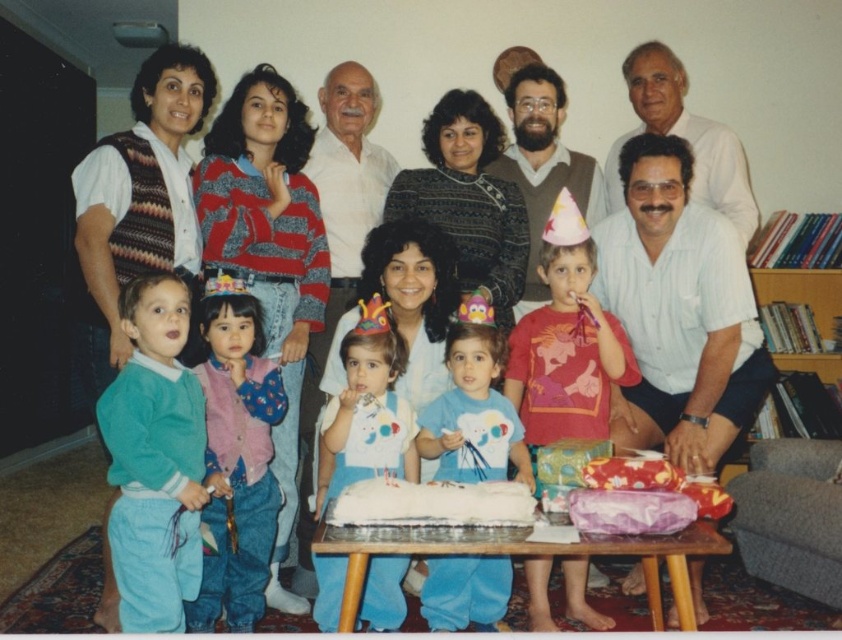
You are taking a photo of the birthday celebration and want to focus on both the point at coordinates point (x=315, y=604) and the point at coordinates point (x=388, y=524). Which point should you focus on first to ensure both are in focus?

You should focus on point (x=315, y=604) first because it is closer to the camera than point (x=388, y=524). This way, adjusting the focus from the closer point to the farther one will help ensure both are in focus.

You are a photographer standing at the camera position. You want to take a closeup photo of the fluffy pink vest at center. The camera has a minimum focusing distance of 5 feet. Can you take the photo?

The fluffy pink vest at center is 7.75 feet from camera. Since the minimum focusing distance is 5 feet, the camera can focus on the fluffy pink vest at center because it is beyond the minimum distance required.

You are a photographer at the birthday celebration and want to capture a photo of the white frosted cake at center without the white matte bib at center appearing in the shot. Based on their positions, which direction should you move the cake or the bib to achieve this?

Since the white matte bib at center is to the left of the white frosted cake at center, you can move the cake to the right or move the bib to the left to ensure the bib does not appear in the photo of the cake.